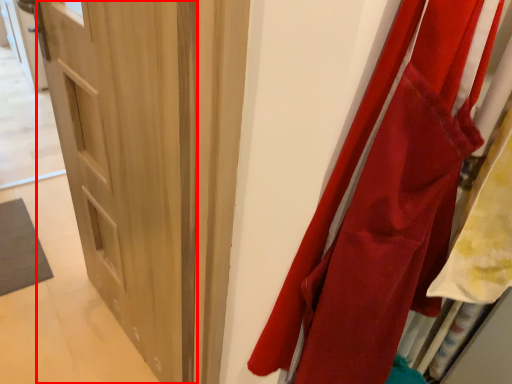
Question: From the image, what is the correct spatial relationship of door (annotated by the red box) in relation to curtain?

Choices:
 (A) left
 (B) right

Answer: (A)